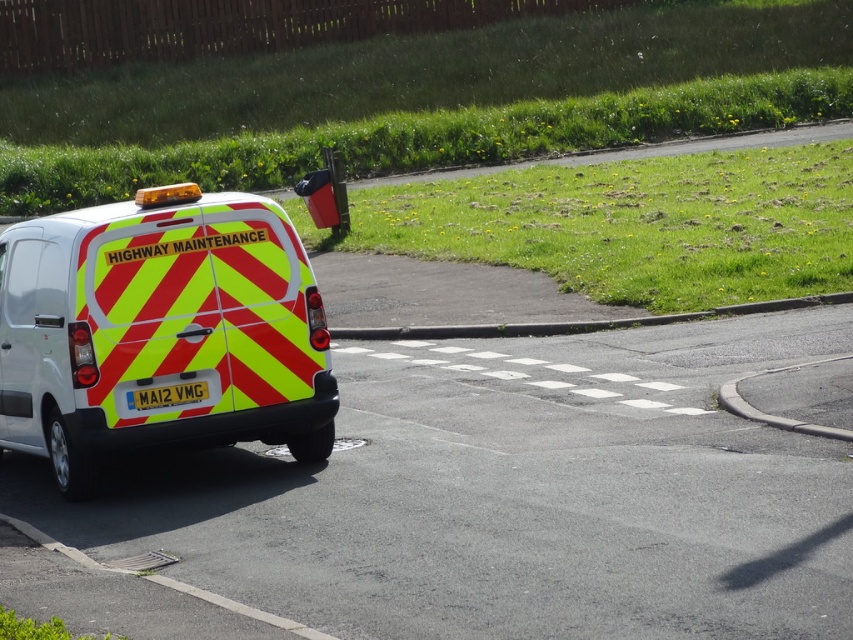
Question: Which object appears farthest from the camera in this image?

Choices:
 (A) yellow reflective plate at rear
 (B) reflective yellow and red van at left

Answer: (A)

Question: Is reflective yellow and red van at left to the right of yellow reflective plate at rear from the viewer's perspective?

Choices:
 (A) no
 (B) yes

Answer: (A)

Question: Which point is farther from the camera taking this photo?

Choices:
 (A) [x=155, y=404]
 (B) [x=38, y=246]

Answer: (B)

Question: Can you confirm if reflective yellow and red van at left is positioned below yellow reflective plate at rear?

Choices:
 (A) no
 (B) yes

Answer: (A)

Question: Can you confirm if reflective yellow and red van at left is bigger than yellow reflective plate at rear?

Choices:
 (A) no
 (B) yes

Answer: (B)